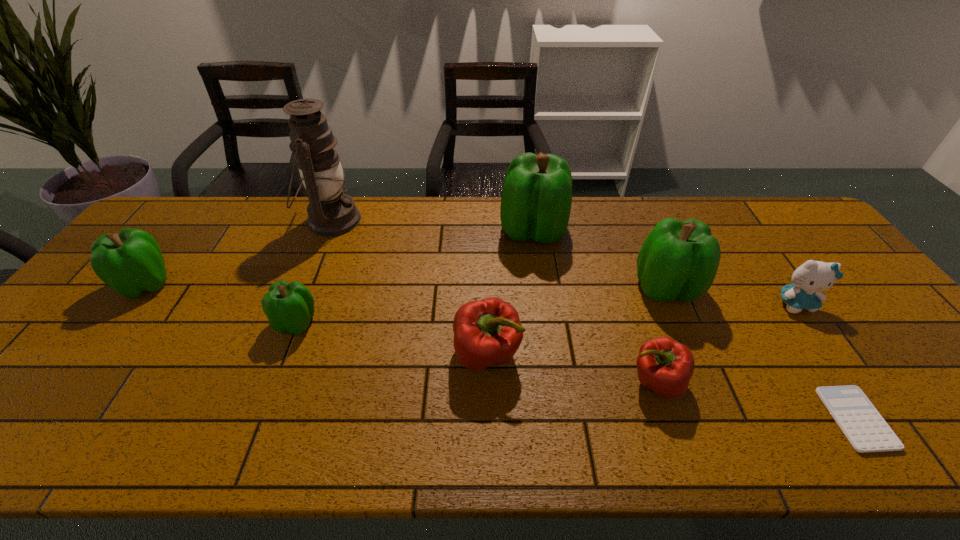
Where is `empty space between the leftmost object and the eighth shortest object`? The width and height of the screenshot is (960, 540). empty space between the leftmost object and the eighth shortest object is located at coordinates (340, 258).

Identify which object is the seventh nearest to the second biggest green bell pepper. Please provide its 2D coordinates. Your answer should be formatted as a tuple, i.e. [(x, y)], where the tuple contains the x and y coordinates of a point satisfying the conditions above.

[(289, 307)]

Select which object appears as the seventh closest to the rightmost green bell pepper. Please provide its 2D coordinates. Your answer should be formatted as a tuple, i.e. [(x, y)], where the tuple contains the x and y coordinates of a point satisfying the conditions above.

[(289, 307)]

Identify the location of bell pepper identified as the third closest to the leftmost green bell pepper. The height and width of the screenshot is (540, 960). (536, 199).

Choose which bell pepper is the fifth nearest neighbor to the third green bell pepper from left to right. Please provide its 2D coordinates. Your answer should be formatted as a tuple, i.e. [(x, y)], where the tuple contains the x and y coordinates of a point satisfying the conditions above.

[(130, 262)]

Locate which green bell pepper is the closest to the smaller pink bell pepper. Please provide its 2D coordinates. Your answer should be formatted as a tuple, i.e. [(x, y)], where the tuple contains the x and y coordinates of a point satisfying the conditions above.

[(679, 260)]

Find the location of a particular element. This screenshot has width=960, height=540. the third closest green bell pepper to the fifth shortest bell pepper is located at coordinates (130, 262).

The width and height of the screenshot is (960, 540). I want to click on free point that satisfies the following two spatial constraints: 1. on the front side of the brown oil lamp; 2. on the left side of the farthest green bell pepper, so click(327, 231).

Where is `vacant area in the image that satisfies the following two spatial constraints: 1. on the front side of the leftmost object; 2. on the left side of the smaller pink bell pepper`? The height and width of the screenshot is (540, 960). vacant area in the image that satisfies the following two spatial constraints: 1. on the front side of the leftmost object; 2. on the left side of the smaller pink bell pepper is located at coordinates (71, 382).

Locate an element on the screen. This screenshot has height=540, width=960. vacant space that satisfies the following two spatial constraints: 1. on the front side of the bigger pink bell pepper; 2. on the right side of the oil lamp is located at coordinates (277, 355).